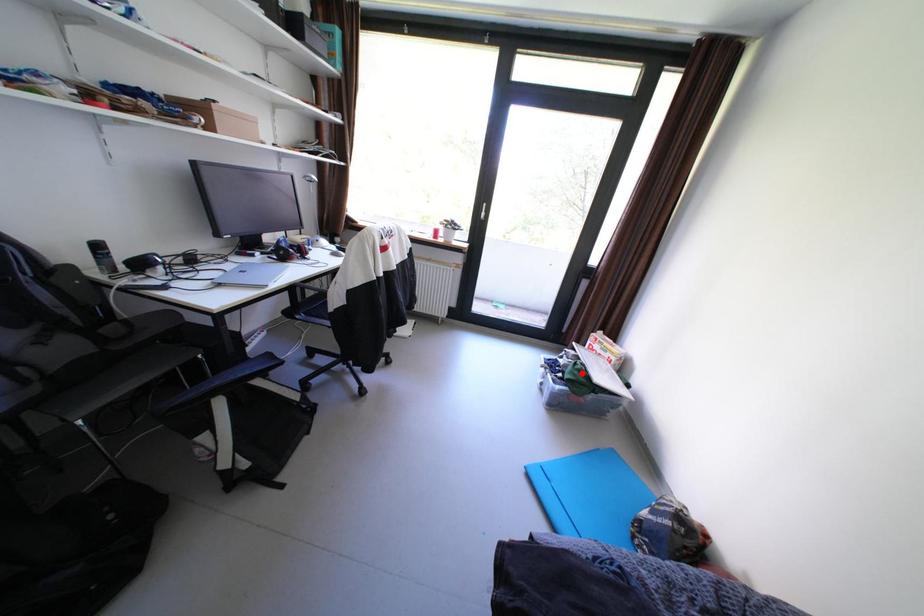
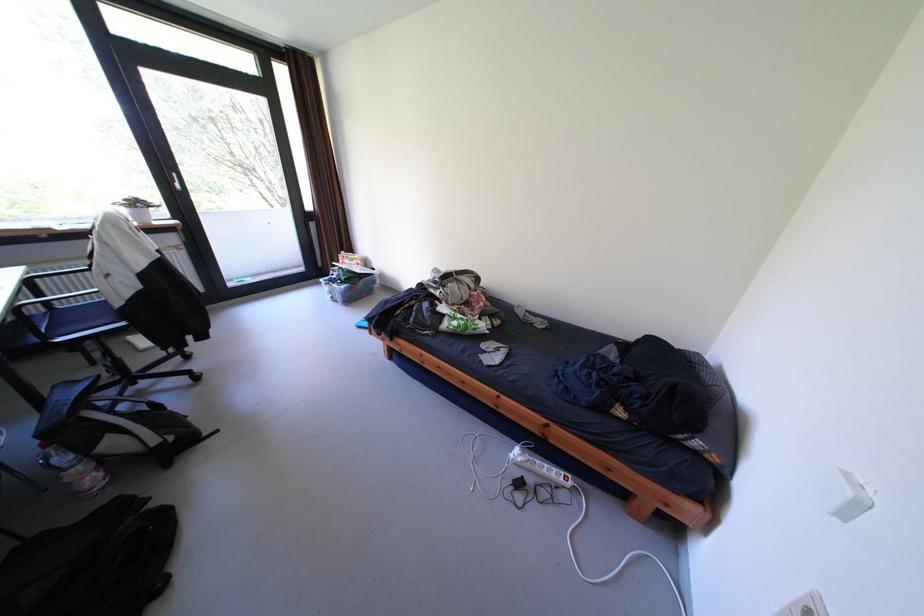
Where in the second image is the point corresponding to the highlighted location from the first image?

(355, 275)